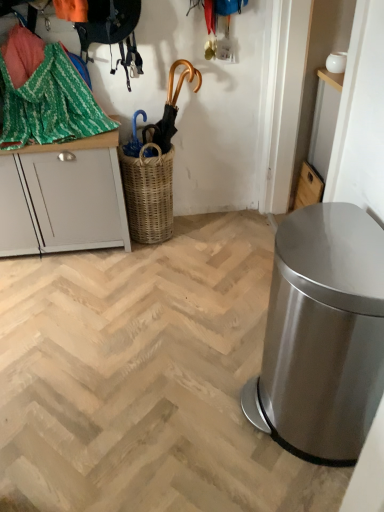
Locate an element on the screen. Image resolution: width=384 pixels, height=512 pixels. free spot above woven brown basket at center (from a real-world perspective) is located at coordinates (145, 131).